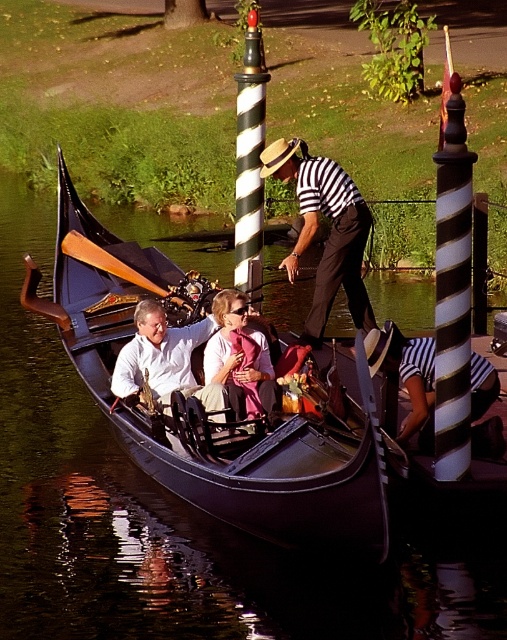
Question: Estimate the real-world distances between objects in this image. Which object is closer to the black polished wood gondola at center?

Choices:
 (A) white matte shirt at center
 (B) brown striped pole at center
 (C) striped fabric referee at center

Answer: (A)

Question: Based on their relative distances, which object is nearer to the black polished wood gondola at center?

Choices:
 (A) pink fabric at center
 (B) white matte shirt at center

Answer: (A)

Question: Is brown striped pole at center bigger than black and white striped pole at center?

Choices:
 (A) yes
 (B) no

Answer: (B)

Question: In this image, where is striped fabric referee at center located relative to white matte shirt at center?

Choices:
 (A) right
 (B) left

Answer: (A)

Question: Which point is closer to the camera?

Choices:
 (A) (140, 369)
 (B) (465, 352)
 (C) (237, 252)
 (D) (239, 419)

Answer: (B)

Question: Is brown striped pole at center further to camera compared to black and white striped pole at center?

Choices:
 (A) no
 (B) yes

Answer: (A)